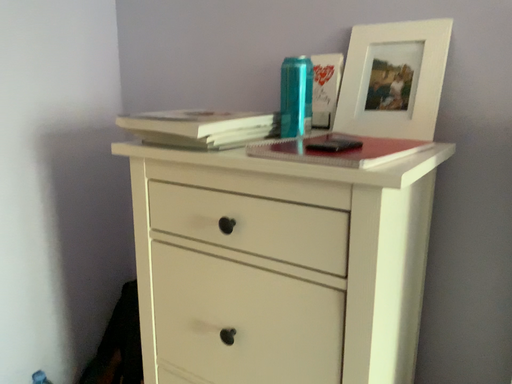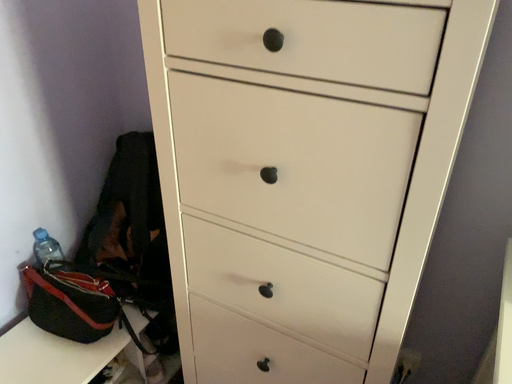
Question: How did the camera likely rotate when shooting the video?

Choices:
 (A) rotated upward
 (B) rotated downward

Answer: (B)